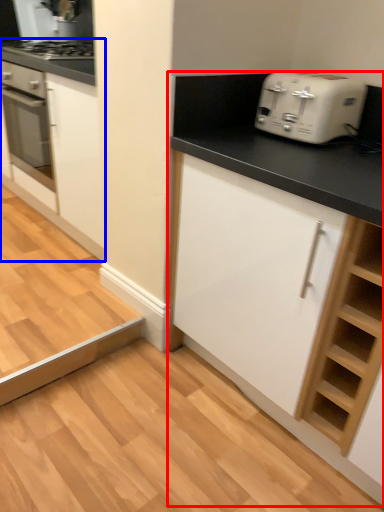
Question: Which point is closer to the camera, cabinetry (highlighted by a red box) or cabinetry (highlighted by a blue box)?

Choices:
 (A) cabinetry
 (B) cabinetry

Answer: (A)